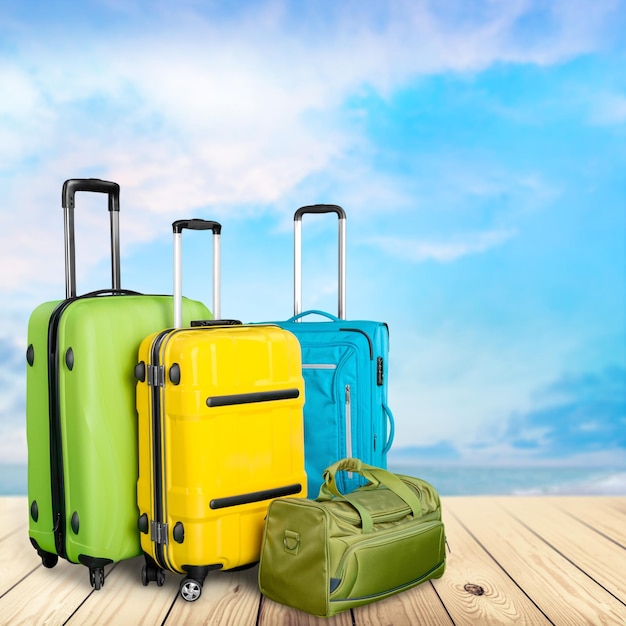
The width and height of the screenshot is (626, 626). What are the coordinates of `handles` in the screenshot? It's located at point(345,463), point(312,203), point(203,225), point(84,187), point(387,428).